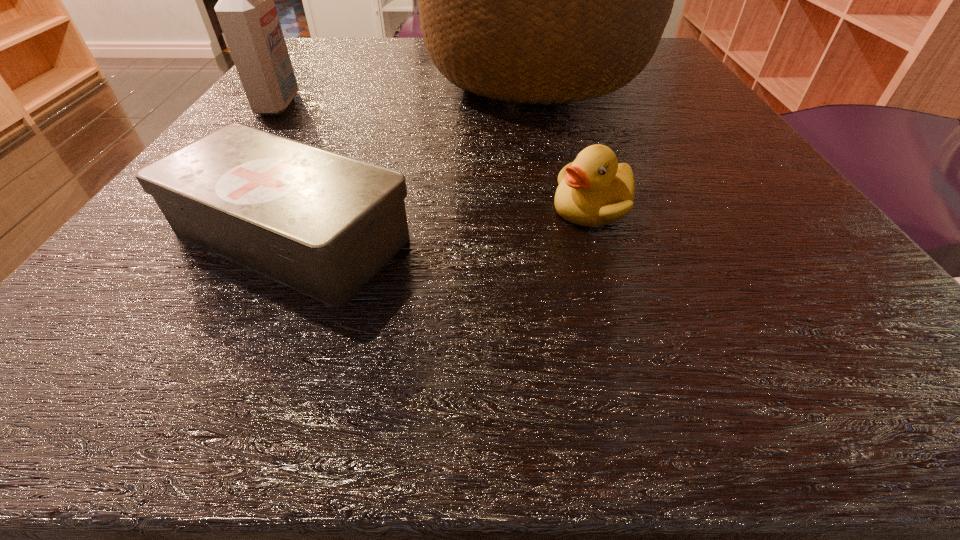
The width and height of the screenshot is (960, 540). I want to click on vacant space at the far right corner of the desktop, so click(655, 70).

You are a GUI agent. You are given a task and a screenshot of the screen. Output one action in this format:
    pyautogui.click(x=<x>, y=<y>)
    Task: Click on the vacant space at the near right corner
    The height and width of the screenshot is (540, 960).
    Given the screenshot: What is the action you would take?
    pyautogui.click(x=761, y=321)

Where is `free space that is in between the first-aid kit and the duckling`? The image size is (960, 540). free space that is in between the first-aid kit and the duckling is located at coordinates (442, 221).

At what (x,y) coordinates should I click in order to perform the action: click on vacant point located between the basket and the first-aid kit. Please return your answer as a coordinate pair (x, y). Looking at the image, I should click on (411, 154).

The image size is (960, 540). Find the location of `vacant region between the first-aid kit and the basket`. vacant region between the first-aid kit and the basket is located at coordinates (411, 154).

Where is `free spot between the duckling and the cleansing agent`? The image size is (960, 540). free spot between the duckling and the cleansing agent is located at coordinates (436, 156).

Where is `vacant space that's between the basket and the first-aid kit`? vacant space that's between the basket and the first-aid kit is located at coordinates (411, 154).

Locate an element on the screen. This screenshot has height=540, width=960. vacant space that is in between the duckling and the basket is located at coordinates (562, 140).

Image resolution: width=960 pixels, height=540 pixels. Find the location of `free space between the first-aid kit and the duckling`. free space between the first-aid kit and the duckling is located at coordinates coord(442,221).

Identify which object is the closest to the first-aid kit. Please provide its 2D coordinates. Your answer should be formatted as a tuple, i.e. [(x, y)], where the tuple contains the x and y coordinates of a point satisfying the conditions above.

[(545, 0)]